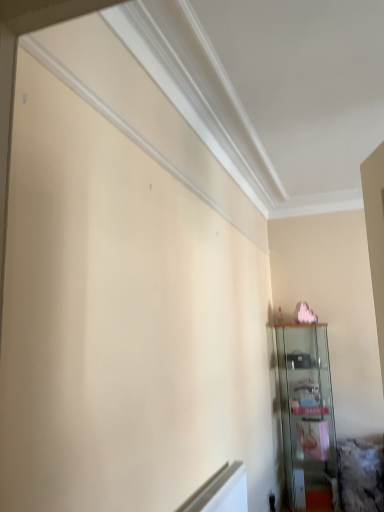
Describe the element at coordinates (307, 415) in the screenshot. I see `clear glass cabinet at right` at that location.

The height and width of the screenshot is (512, 384). Find the location of `clear glass cabinet at right`. clear glass cabinet at right is located at coordinates (307, 415).

In order to face clear glass cabinet at right, should I rotate leftwards or rightwards?

Turn right approximately 15.227 degrees to face it.

Measure the distance between clear glass cabinet at right and camera.

A distance of 3.67 meters exists between clear glass cabinet at right and camera.

Where is `clear glass cabinet at right`? Image resolution: width=384 pixels, height=512 pixels. clear glass cabinet at right is located at coordinates (307, 415).